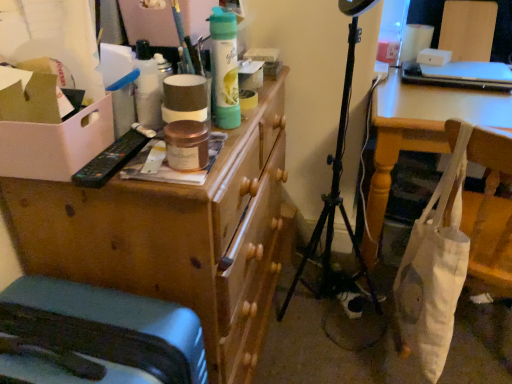
Question: Considering the relative positions of white cardboard box at left and white canvas tote at lower right in the image provided, is white cardboard box at left to the left or to the right of white canvas tote at lower right?

Choices:
 (A) right
 (B) left

Answer: (B)

Question: From a real-world perspective, relative to white canvas tote at lower right, is white cardboard box at left vertically above or below?

Choices:
 (A) above
 (B) below

Answer: (A)

Question: Estimate the real-world distances between objects in this image. Which object is farther from the white cardboard box at left?

Choices:
 (A) white fabric bag at lower right
 (B) matte gray suitcase at lower left
 (C) wooden chest of drawers at upper left
 (D) white canvas tote at lower right

Answer: (A)

Question: Which object is the farthest from the matte gray suitcase at lower left?

Choices:
 (A) wooden chest of drawers at upper left
 (B) white fabric bag at lower right
 (C) white cardboard box at left
 (D) white canvas tote at lower right

Answer: (B)